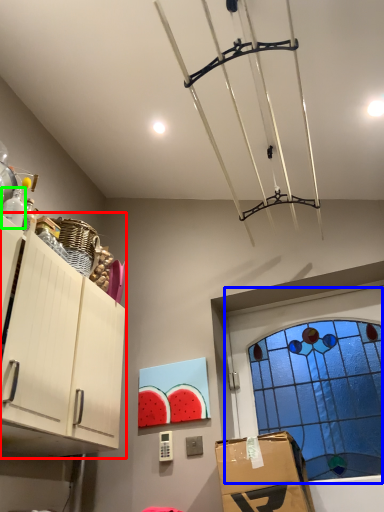
Question: Which is farther away from cabinetry (highlighted by a red box)? window (highlighted by a blue box) or bottle (highlighted by a green box)?

Choices:
 (A) window
 (B) bottle

Answer: (A)